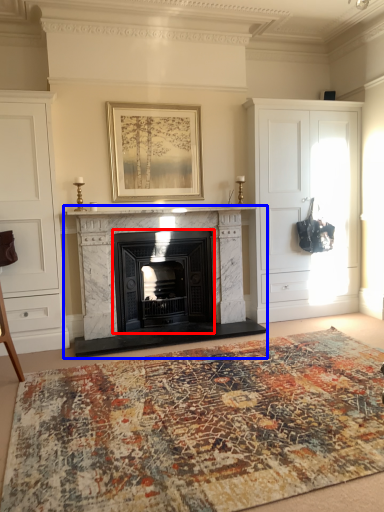
Question: Which point is further to the camera, wood burning stove (highlighted by a red box) or fireplace (highlighted by a blue box)?

Choices:
 (A) wood burning stove
 (B) fireplace

Answer: (A)